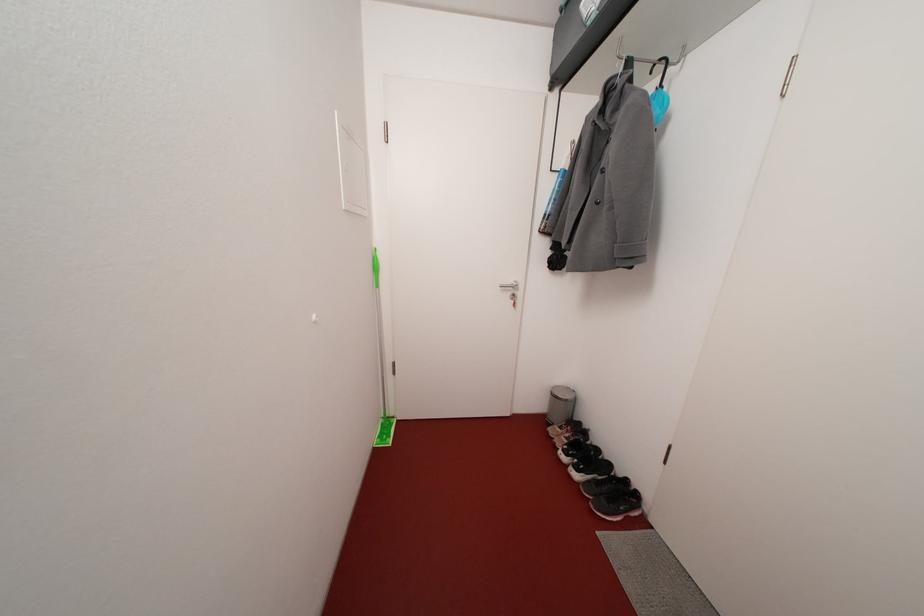
Image resolution: width=924 pixels, height=616 pixels. Find the location of `black and white shoe`. black and white shoe is located at coordinates (585, 461).